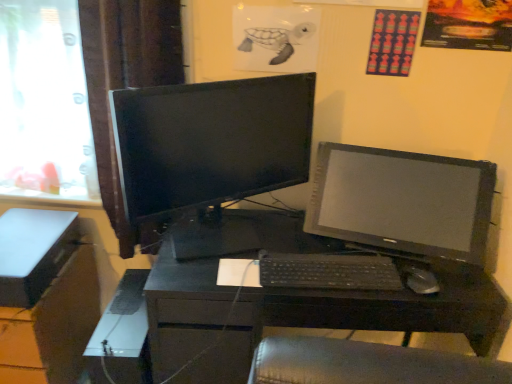
You are a GUI agent. You are given a task and a screenshot of the screen. Output one action in this format:
    pyautogui.click(x=<x>, y=<y>)
    Task: Click on the vacant space behind black plastic keyboard at center
    Image resolution: width=512 pixels, height=384 pixels.
    Given the screenshot: What is the action you would take?
    pyautogui.click(x=292, y=231)